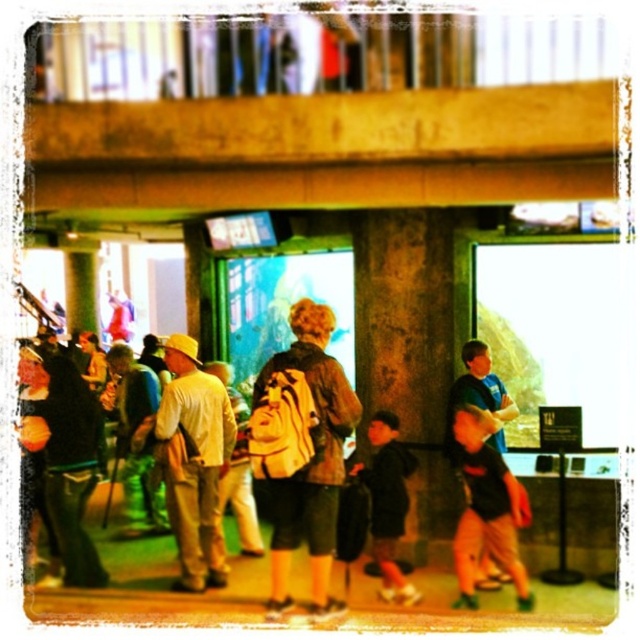
You are a tour guide leading a group at the aquarium. You notice a visitor wearing a light beige cotton shirt at center and another carrying a white backpack at center. Which of these items is located to the right when viewed from your perspective?

The light beige cotton shirt at center is positioned on the right side of the white backpack at center, so the light beige cotton shirt at center is located to the right.

You are a photographer standing in the aquarium. You notice a concrete textured pillar at center and a light beige cotton shirt at center. Which object would block your view more if you try to take a photo through the center area?

The concrete textured pillar at center is larger in size than the light beige cotton shirt at center, so it would block your view more when taking a photo through the center area.

You are standing in the aquarium and want to take a photo of both the point at coordinates (204, 436) and the point at (125, 486). Which point should you focus on first to ensure both are in clear view?

You should focus on point (204, 436) first because it is closer to you than point (125, 486), ensuring both points are in focus when capturing the image.